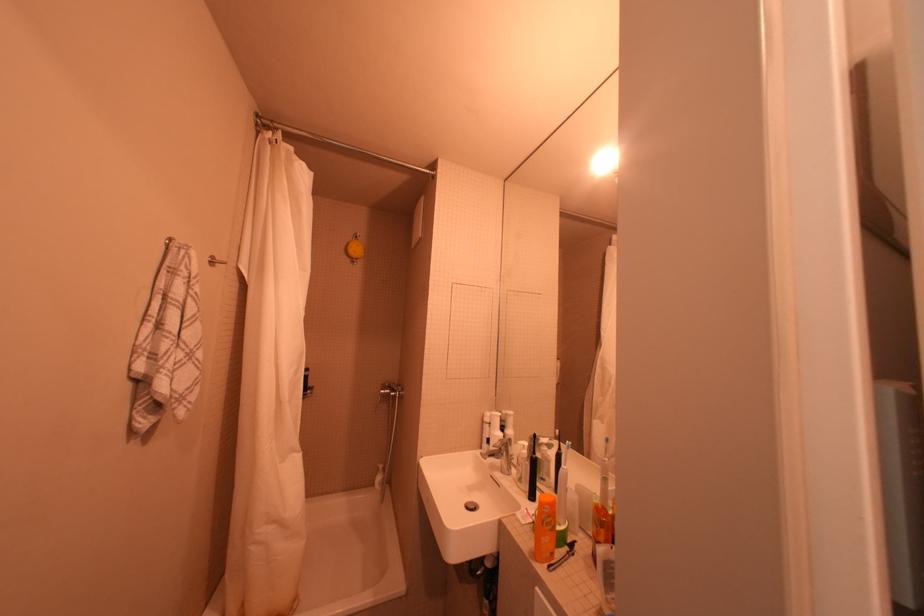
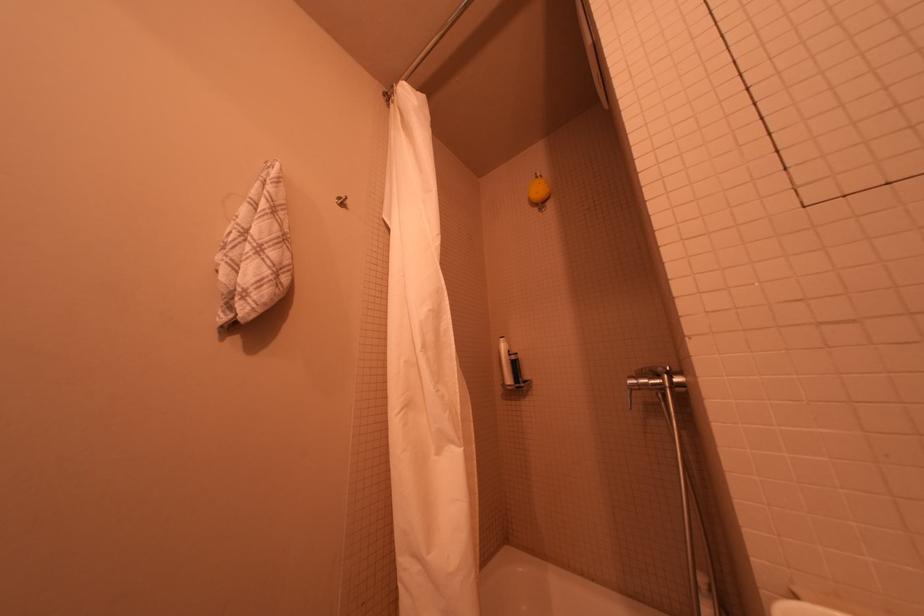
Based on the continuous images, in which direction is the camera rotating?

The camera rotated toward left-up.